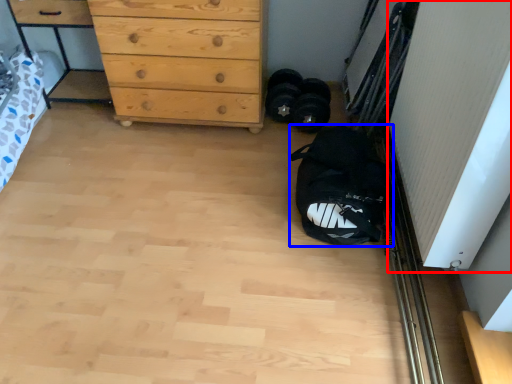
Question: Among these objects, which one is farthest to the camera, screen door (highlighted by a red box) or sack (highlighted by a blue box)?

Choices:
 (A) screen door
 (B) sack

Answer: (B)